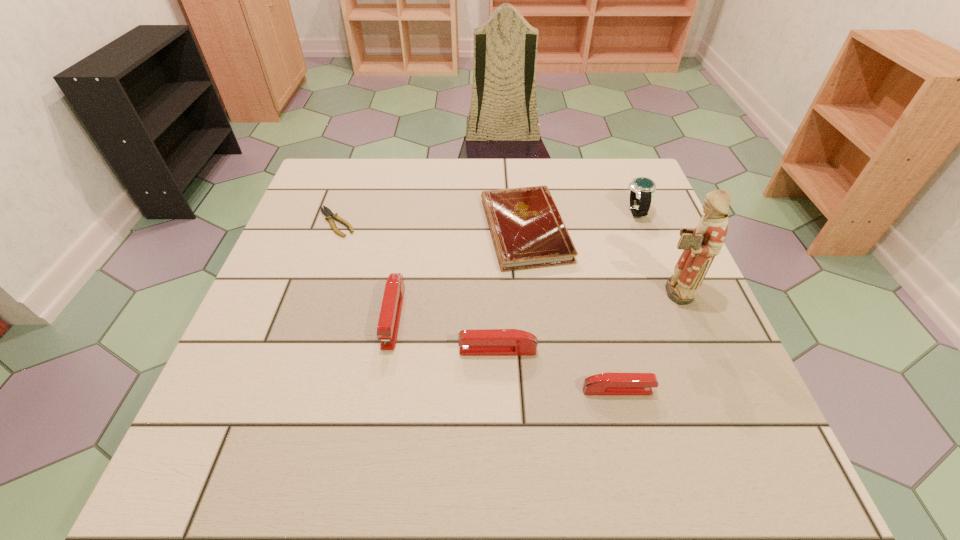
Please point a spot to add another stapler on the left. Please provide its 2D coordinates. Your answer should be formatted as a tuple, i.e. [(x, y)], where the tuple contains the x and y coordinates of a point satisfying the conditions above.

[(302, 285)]